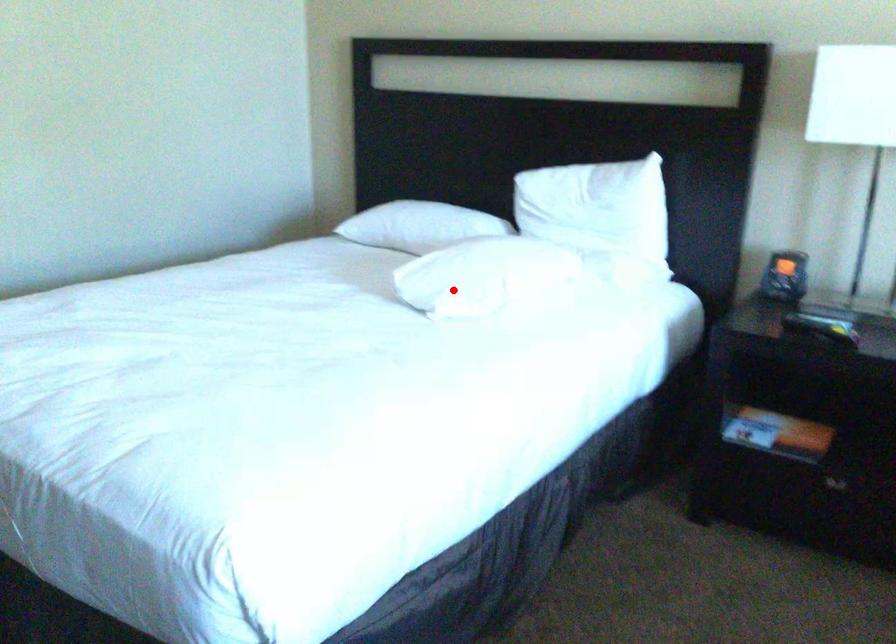
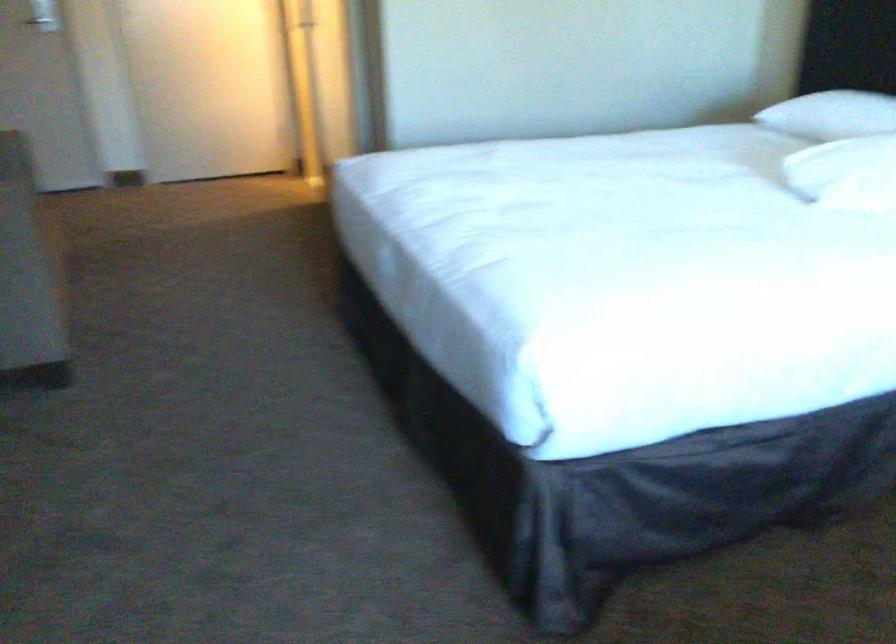
Where in the second image is the point corresponding to the highlighted location from the first image?

(846, 173)